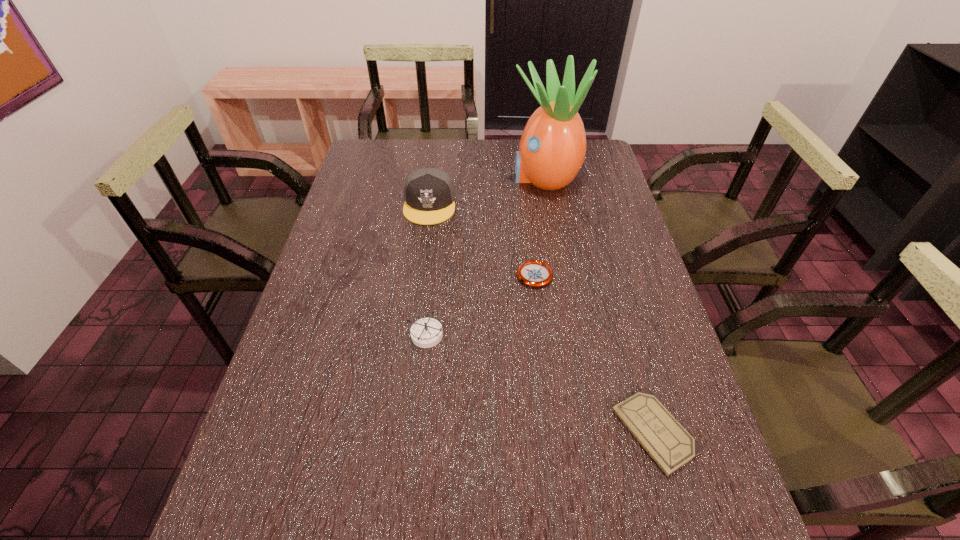
You are a GUI agent. You are given a task and a screenshot of the screen. Output one action in this format:
    pyautogui.click(x=<x>, y=<y>)
    Task: Click on the vacant area situated 0.050m at the entrance of the pineapple
    
    Given the screenshot: What is the action you would take?
    pyautogui.click(x=495, y=177)

The width and height of the screenshot is (960, 540). Find the location of `free spot located 0.070m on the front-facing side of the cap`. free spot located 0.070m on the front-facing side of the cap is located at coordinates (425, 241).

What are the coordinates of `vacant region located on the front of the nearer compass` in the screenshot? It's located at pyautogui.click(x=420, y=395).

Where is `free location located on the back of the right compass`? The height and width of the screenshot is (540, 960). free location located on the back of the right compass is located at coordinates (526, 201).

At what (x,y) coordinates should I click in order to perform the action: click on vacant space located on the left of the checkbook. Please return your answer as a coordinate pair (x, y). The image size is (960, 540). Looking at the image, I should click on (554, 431).

I want to click on object that is at the far edge, so 552,149.

This screenshot has width=960, height=540. In order to click on pineapple that is at the right edge in this screenshot , I will do [x=552, y=149].

At what (x,y) coordinates should I click in order to perform the action: click on checkbook that is at the right edge. Please return your answer as a coordinate pair (x, y). Looking at the image, I should click on (671, 446).

Locate an element on the screen. Image resolution: width=960 pixels, height=540 pixels. object that is at the far right corner is located at coordinates click(x=552, y=149).

In the image, there is a desktop. Find the location of `blank space at the far edge`. blank space at the far edge is located at coordinates (407, 169).